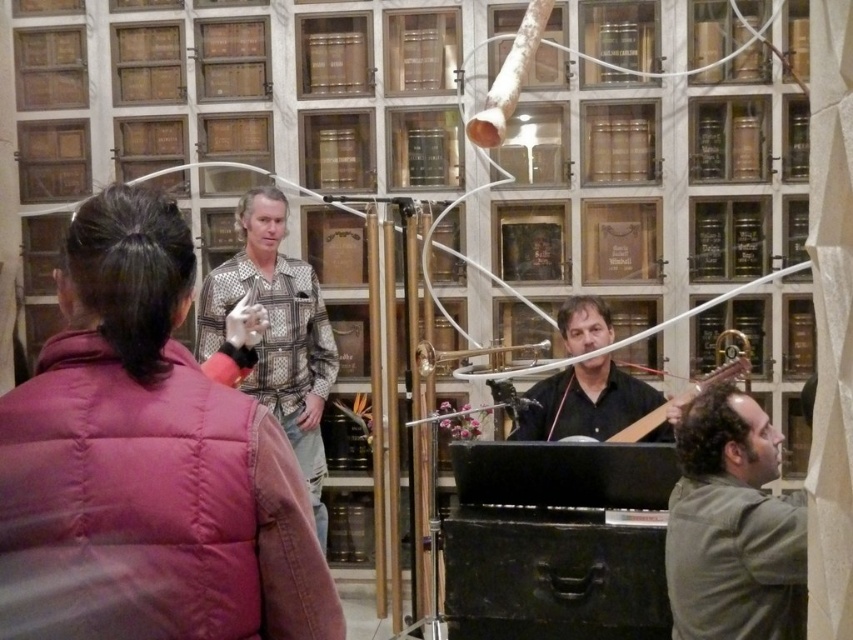
You are a photographer setting up for a group photo. You need to ensure that the green matte shirt at lower right and the black matte guitar at center are both visible in the frame. Given their sizes, which object should you prioritize positioning closer to the camera to maintain clarity?

The green matte shirt at lower right has a lesser width compared to the black matte guitar at center. To maintain clarity for both, prioritize positioning the green matte shirt at lower right closer to the camera since it is smaller and might be harder to see from a distance.

You are a photographer trying to capture a photo of both the puffy pink vest at center and the black matte guitar at center in the same frame. Given that your camera has a minimum focus distance of 2 meters, will you be able to take the photo without moving either object?

The puffy pink vest at center and the black matte guitar at center are 1.96 meters apart from each other. Since the distance between them is less than the camera minimum focus distance of 2 meters, you can take the photo without moving either object.

You are attending a concert in the library and notice the green matte shirt at lower right and the black matte guitar at center. Which object takes up more space in the scene?

The black matte guitar at center takes up more space than the green matte shirt at lower right.